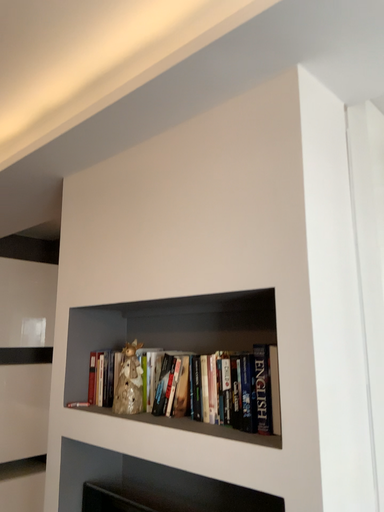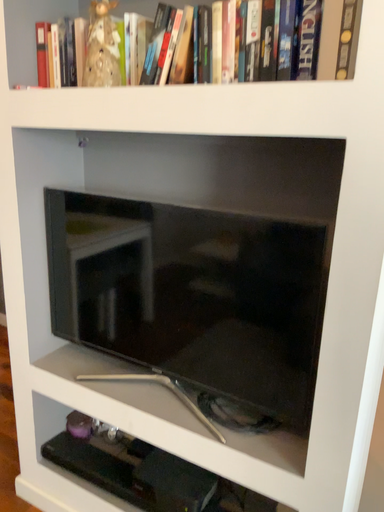
Question: Which way did the camera rotate in the video?

Choices:
 (A) rotated upward
 (B) rotated downward

Answer: (B)